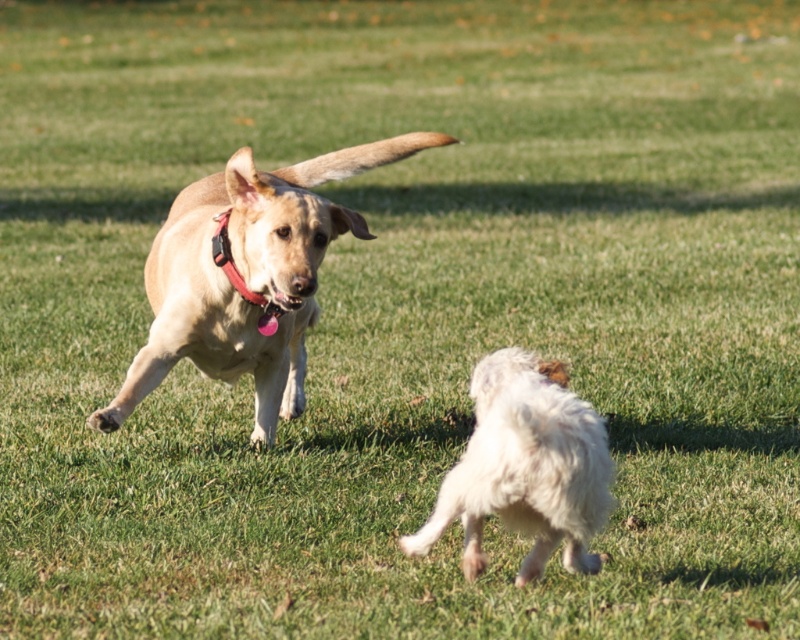
Question: Which object appears farthest from the camera in this image?

Choices:
 (A) white fluffy dog at lower right
 (B) red leather collar at upper center

Answer: (B)

Question: Is light brown fur dog at center wider than red leather collar at upper center?

Choices:
 (A) yes
 (B) no

Answer: (A)

Question: Is white fluffy dog at lower right smaller than red leather collar at upper center?

Choices:
 (A) yes
 (B) no

Answer: (B)

Question: Estimate the real-world distances between objects in this image. Which object is closer to the red leather collar at upper center?

Choices:
 (A) light brown fur dog at center
 (B) white fluffy dog at lower right

Answer: (A)

Question: Is white fluffy dog at lower right positioned at the back of red leather collar at upper center?

Choices:
 (A) no
 (B) yes

Answer: (A)

Question: Which point appears closest to the camera in this image?

Choices:
 (A) (113, 422)
 (B) (432, 536)
 (C) (218, 256)

Answer: (B)